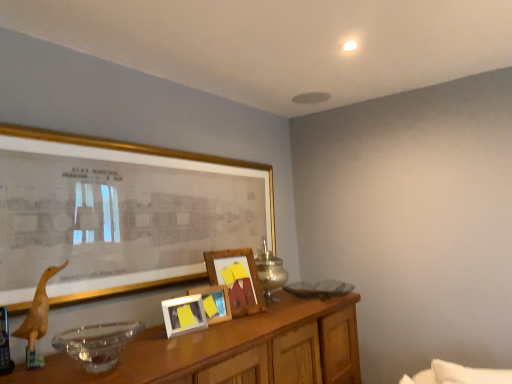
Question: Is metallic silver table lamp at center to the left or to the right of wooden duckling at left in the image?

Choices:
 (A) left
 (B) right

Answer: (B)

Question: Based on their sizes in the image, would you say metallic silver table lamp at center is bigger or smaller than wooden duckling at left?

Choices:
 (A) small
 (B) big

Answer: (B)

Question: Considering the real-world distances, which object is farthest from the wooden table at lower center?

Choices:
 (A) metallic silver table lamp at center
 (B) matte gold picture frame at upper left, which ranks as the 4th picture frame in back-to-front order
 (C) wooden picture frame at center, positioned as the first picture frame in back-to-front order
 (D) transparent glass bowl at center
 (E) wooden picture frame at center, which is the 2th picture frame in back-to-front order

Answer: (B)

Question: Which object is positioned farthest from the wooden picture frame at center, the third picture frame positioned from the front?

Choices:
 (A) matte wooden picture frame at center, which is counted as the 3th picture frame, starting from the back
 (B) metallic silver table lamp at center
 (C) wooden duckling at left
 (D) wooden table at lower center
 (E) matte gold picture frame at upper left, which ranks as the 4th picture frame in back-to-front order

Answer: (C)